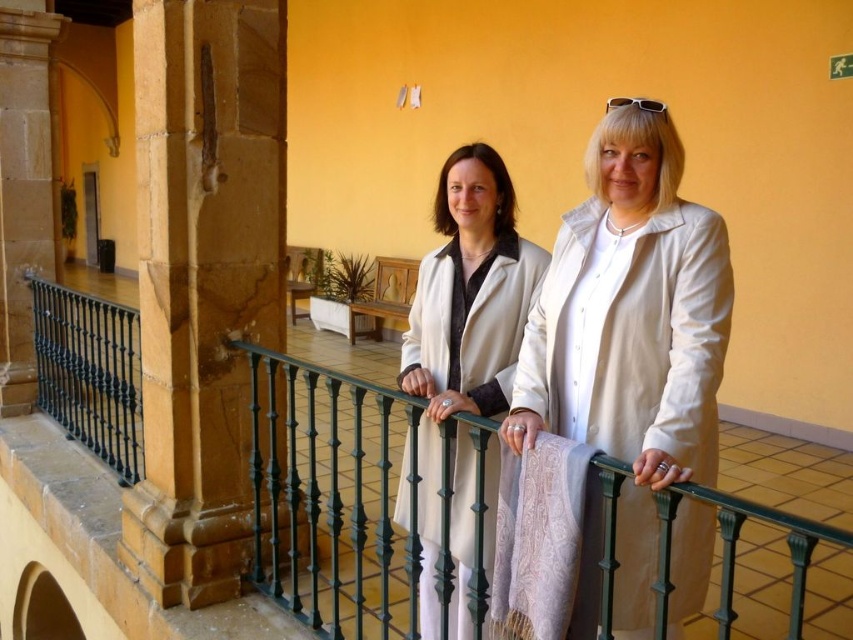
Is point (318, 566) closer to camera compared to point (462, 208)?

No, it is not.

Who is more distant from viewer, (816, 573) or (459, 392)?

Positioned behind is point (816, 573).

Where is `black wrought iron at center`? This screenshot has width=853, height=640. black wrought iron at center is located at coordinates (786, 474).

Is matte white coat at center thinner than sandy stone pillar at left?

Incorrect, matte white coat at center's width is not less than sandy stone pillar at left's.

The height and width of the screenshot is (640, 853). Describe the element at coordinates (463, 324) in the screenshot. I see `matte white coat at center` at that location.

This screenshot has height=640, width=853. I want to click on matte white coat at center, so click(x=463, y=324).

This screenshot has width=853, height=640. What do you see at coordinates (202, 280) in the screenshot?
I see `marble column at left` at bounding box center [202, 280].

Does marble column at left have a greater width compared to matte white coat at center?

Indeed, marble column at left has a greater width compared to matte white coat at center.

The width and height of the screenshot is (853, 640). Identify the location of marble column at left. (202, 280).